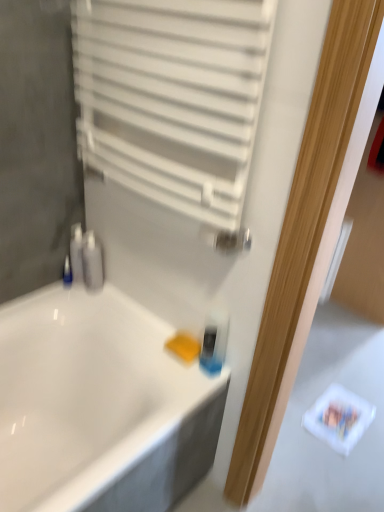
The image size is (384, 512). Find the location of `free space on the front side of translucent plastic mouthwash at center`. free space on the front side of translucent plastic mouthwash at center is located at coordinates [x=186, y=396].